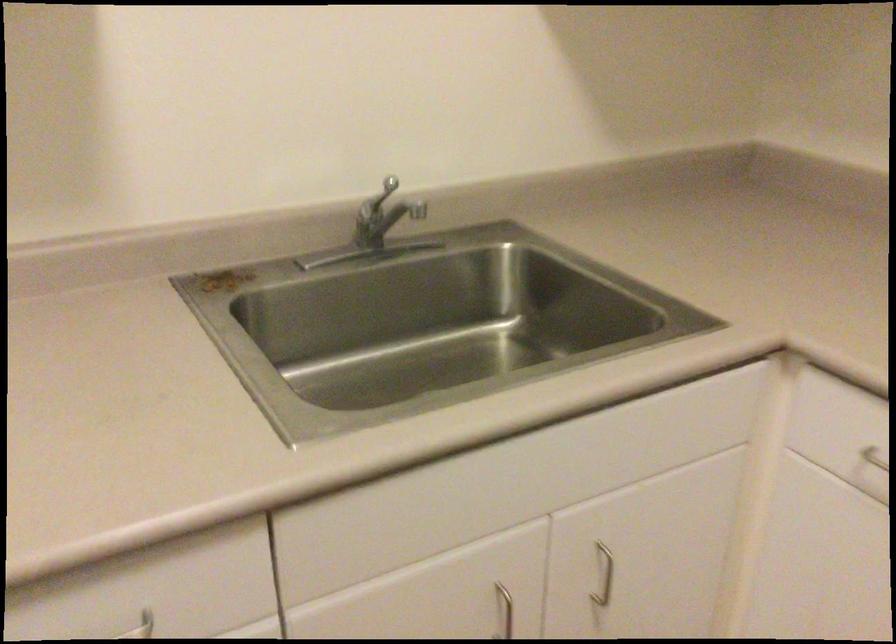
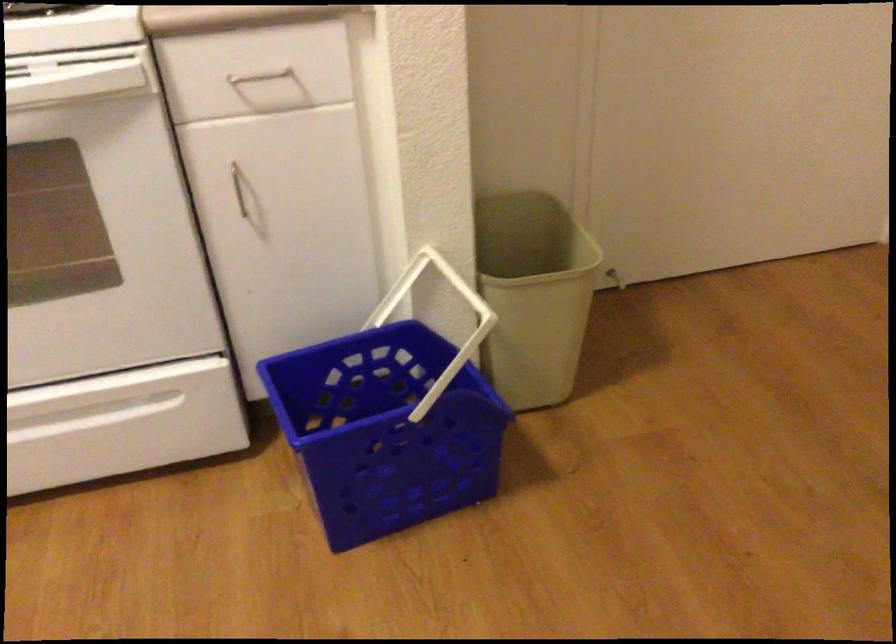
How did the camera likely rotate?

The camera's rotation is toward right-down.